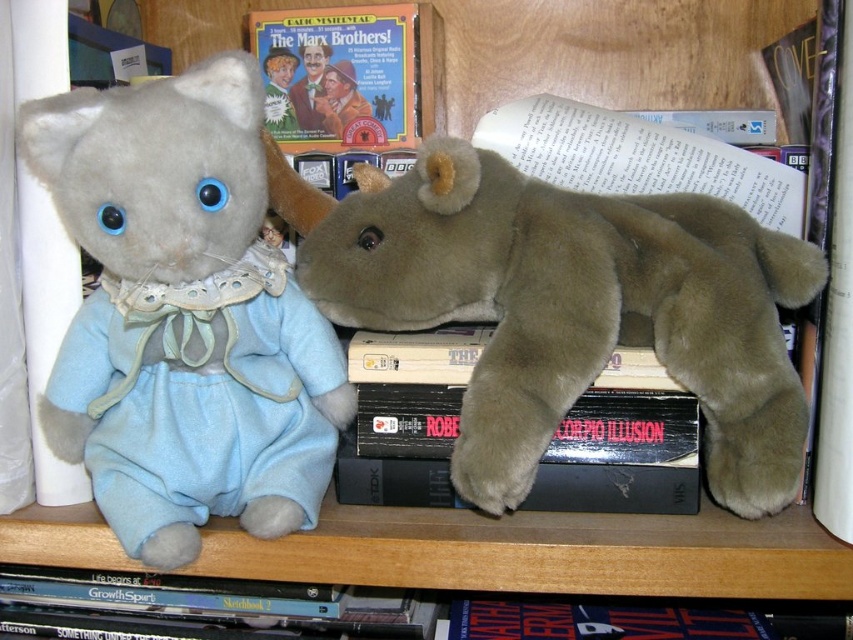
Question: Which point is closer to the camera?

Choices:
 (A) matte cardboard book at center
 (B) black matte book at center

Answer: (B)

Question: Is brown plush bear at center wider than black matte book at center?

Choices:
 (A) no
 (B) yes

Answer: (B)

Question: Which of the following is the closest to the observer?

Choices:
 (A) black matte book at center
 (B) matte cardboard book at center
 (C) brown plush bear at center

Answer: (C)

Question: Is brown plush bear at center closer to the viewer compared to black matte book at center?

Choices:
 (A) no
 (B) yes

Answer: (B)

Question: Does brown plush bear at center have a larger size compared to black matte book at center?

Choices:
 (A) yes
 (B) no

Answer: (A)

Question: Which point is farther from the camera taking this photo?

Choices:
 (A) (521, 298)
 (B) (262, 58)

Answer: (B)